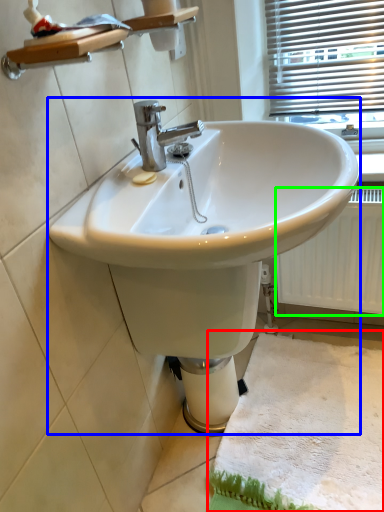
Question: Which object is positioned farthest from bath mat (highlighted by a red box)? Select from sink (highlighted by a blue box) and radiator (highlighted by a green box).

Choices:
 (A) sink
 (B) radiator

Answer: (A)